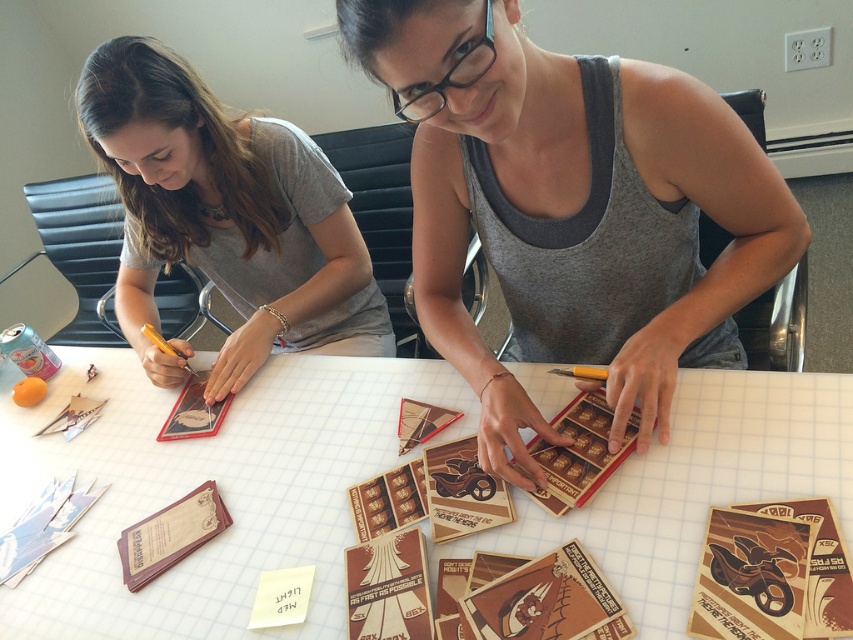
In the scene shown: You are a new intern who just entered the room and need to hand a document to the person wearing the matte gray shirt at upper left. The document is on the white grid paper at center. Can you reach the document without moving any objects?

The white grid paper at center is below the matte gray shirt at upper left, so you can easily reach the document on the white grid paper at center without needing to move anything.

You are a photographer planning to take a group photo of the two people at the table. You want to arrange them so that the person in the gray tank top at center is on the right side of the matte gray shirt at upper left. Is this arrangement already correct based on the current scene?

Yes, the gray tank top at center is already positioned on the right side of the matte gray shirt at upper left, so the arrangement is correct.

You are standing 1 meter away from the table. Can you reach the point at coordinates (294, 401) on the table without moving closer?

The distance of point (294, 401) from the camera is 1.20 meters. Since you are standing 1 meter away from the table, you are 0.20 meters closer than the point. Therefore, you can reach the point without moving closer.